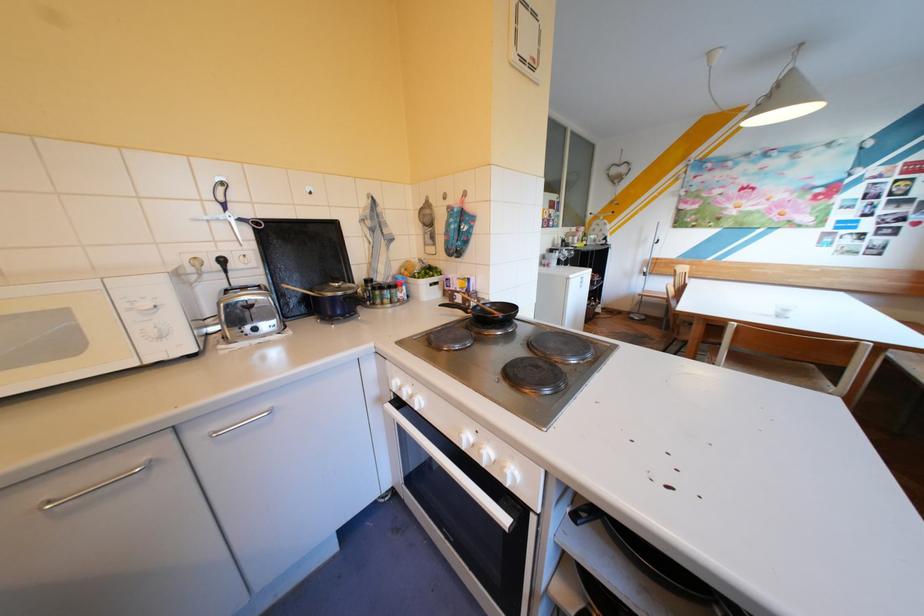
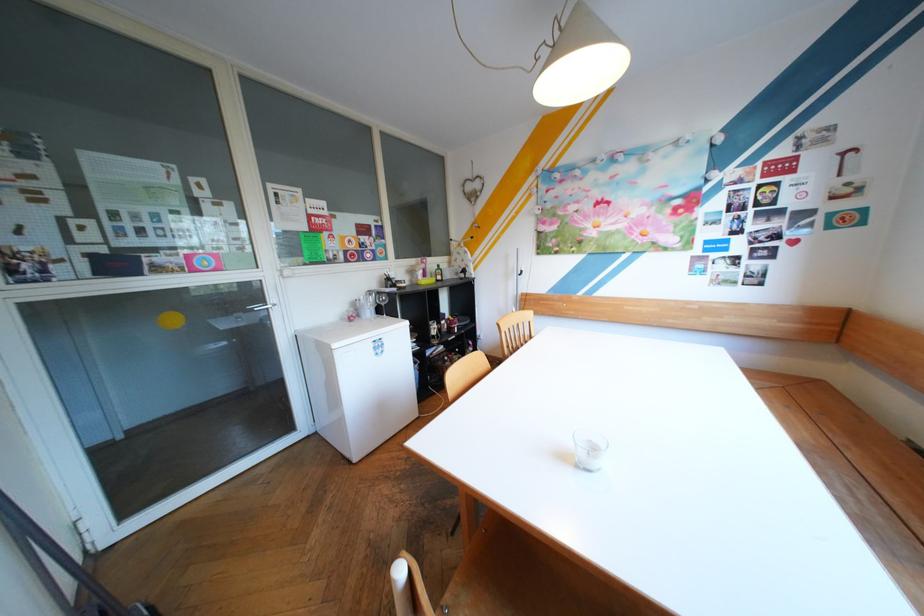
Where in the second image is the point corresponding to point (565, 249) from the first image?

(383, 292)